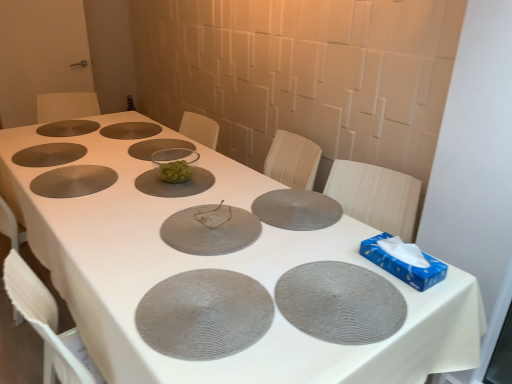
At what (x,y) coordinates should I click in order to perform the action: click on vacant space underneath matte gray placemat at left, which appears as the sixth glass plate when viewed from the back (from a real-world perspective). Please return your answer as a coordinate pair (x, y). Looking at the image, I should click on (72, 175).